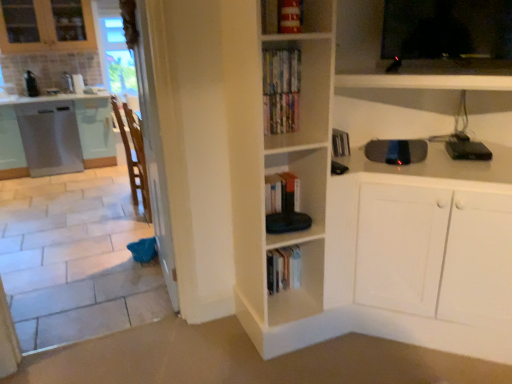
Locate an element on the screen. This screenshot has height=384, width=512. black glossy tv at upper right is located at coordinates (403, 61).

I want to click on white tile at left, so click(75, 258).

Find the location of a particular element. This screenshot has height=384, width=512. black plastic skateboard at upper right, which ranks as the first appliance in bottom-to-top order is located at coordinates (396, 151).

Describe the element at coordinates (467, 149) in the screenshot. The height and width of the screenshot is (384, 512). I see `black plastic device at upper right, which is the second appliance from bottom to top` at that location.

The image size is (512, 384). Describe the element at coordinates (50, 138) in the screenshot. I see `satin white dishwasher at left, which appears as the 2th cabinetry when viewed from the right` at that location.

You are a GUI agent. You are given a task and a screenshot of the screen. Output one action in this format:
    pyautogui.click(x=<x>, y=<y>)
    Task: Click on the black glossy tv at upper right
    This screenshot has width=512, height=384.
    Given the screenshot: What is the action you would take?
    pyautogui.click(x=403, y=61)

Is brown wooden chair at left further to the viewer compared to white tile at left?

Yes, the depth of brown wooden chair at left is greater than that of white tile at left.

Between brown wooden chair at left and white tile at left, which one has larger size?

white tile at left is bigger.

Is brown wooden chair at left situated inside white tile at left or outside?

brown wooden chair at left cannot be found inside white tile at left.

Is satin white dishwasher at left, which is the 1th cabinetry from left to right, facing towards black plastic skateboard at upper right, which appears as the second appliance when viewed from the right?

No, satin white dishwasher at left, which is the 1th cabinetry from left to right, does not turn towards black plastic skateboard at upper right, which appears as the second appliance when viewed from the right.

Can you see satin white dishwasher at left, which appears as the 2th cabinetry when viewed from the right, touching black plastic skateboard at upper right, the 3th appliance when ordered from top to bottom?

They are not placed beside each other.

Who is shorter, satin white dishwasher at left, which is the 1th cabinetry from left to right, or black plastic skateboard at upper right, which ranks as the first appliance in bottom-to-top order?

With less height is black plastic skateboard at upper right, which ranks as the first appliance in bottom-to-top order.

Image resolution: width=512 pixels, height=384 pixels. What are the coordinates of `shelf that is on the right side of hardcover books at upper center` in the screenshot? It's located at (403, 61).

Which point is more distant from viewer, (337,62) or (292,74)?

Positioned behind is point (337,62).

Would you consider black glossy tv at upper right to be distant from hardcover books at upper center?

They are positioned close to each other.

In the scene shown: Between black plastic device at upper right, which is the 1th appliance in right-to-left order, and white tile at left, which one appears on the right side from the viewer's perspective?

black plastic device at upper right, which is the 1th appliance in right-to-left order, is more to the right.

Between black plastic device at upper right, arranged as the 2th appliance when viewed from the front, and white tile at left, which one has smaller width?

black plastic device at upper right, arranged as the 2th appliance when viewed from the front, is thinner.

Is black plastic device at upper right, the second appliance viewed from the back, closer to the viewer compared to white tile at left?

No, it is not.

From the image's perspective, which is below, black plastic device at upper right, arranged as the 2th appliance when viewed from the front, or white tile at left?

white tile at left.

Based on the photo, is black plastic device at upper right, arranged as the 2th appliance when viewed from the front, facing towards black glossy tv at upper right?

No, black plastic device at upper right, arranged as the 2th appliance when viewed from the front, is not turned towards black glossy tv at upper right.

Which object is thinner, black plastic device at upper right, arranged as the second appliance when viewed from the top, or black glossy tv at upper right?

Thinner between the two is black glossy tv at upper right.

Where is `appliance that is the 2nd object located behind the black glossy tv at upper right`? This screenshot has width=512, height=384. appliance that is the 2nd object located behind the black glossy tv at upper right is located at coordinates (467, 149).

This screenshot has width=512, height=384. Identify the location of screen door that is in front of the black plastic skateboard at upper right, marked as the 2th appliance in a left-to-right arrangement. (151, 140).

Considering the positions of objects black plastic skateboard at upper right, which appears as the second appliance when viewed from the right, and transparent plastic screen door at left in the image provided, who is more to the left, black plastic skateboard at upper right, which appears as the second appliance when viewed from the right, or transparent plastic screen door at left?

Positioned to the left is transparent plastic screen door at left.

From the image's perspective, which one is positioned higher, black plastic skateboard at upper right, marked as the 2th appliance in a left-to-right arrangement, or transparent plastic screen door at left?

transparent plastic screen door at left is shown above in the image.

How distant is black plastic skateboard at upper right, marked as the 2th appliance in a left-to-right arrangement, from transparent plastic screen door at left?

black plastic skateboard at upper right, marked as the 2th appliance in a left-to-right arrangement, and transparent plastic screen door at left are 1.24 meters apart from each other.

Is brushed metal toaster at left, the third appliance when ordered from bottom to top, oriented towards satin white dishwasher at left, which is the 1th cabinetry from left to right?

No, brushed metal toaster at left, the third appliance when ordered from bottom to top, is not turned towards satin white dishwasher at left, which is the 1th cabinetry from left to right.

Is point (28, 93) farther from camera compared to point (26, 155)?

That is True.

Which of these two, brushed metal toaster at left, which is the third appliance from front to back, or satin white dishwasher at left, which is the 1th cabinetry from left to right, is smaller?

With smaller size is brushed metal toaster at left, which is the third appliance from front to back.

Is brushed metal toaster at left, arranged as the first appliance when viewed from the back, far from satin white dishwasher at left, which is the 1th cabinetry from left to right?

They are positioned close to each other.

Identify the location of tile on the left of brown wooden chair at left. (75, 258).

What are the coordinates of `appliance that is the 2nd object located below the satin white dishwasher at left, which appears as the 2th cabinetry when viewed from the right (from the image's perspective)` in the screenshot? It's located at (396, 151).

Based on the photo, looking at the image, which one is located further to satin white dishwasher at left, which appears as the 2th cabinetry when viewed from the right, white glossy cabinet at left, the 1th cabinetry in the right-to-left sequence, or black plastic skateboard at upper right, marked as the 2th appliance in a left-to-right arrangement?

black plastic skateboard at upper right, marked as the 2th appliance in a left-to-right arrangement, is positioned further to the anchor satin white dishwasher at left, which appears as the 2th cabinetry when viewed from the right.

Considering their positions, is black glossy tv at upper right positioned further to white glossy cabinet at left, placed as the 2th cabinetry when sorted from left to right, than hardcover books at upper center?

black glossy tv at upper right.

Estimate the real-world distances between objects in this image. Which object is further from black plastic skateboard at upper right, which appears as the second appliance when viewed from the right, transparent plastic screen door at left or brown wooden chair at left?

brown wooden chair at left is positioned further to the anchor black plastic skateboard at upper right, which appears as the second appliance when viewed from the right.

Estimate the real-world distances between objects in this image. Which object is further from brown wooden chair at left, black plastic device at upper right, which is the second appliance from bottom to top, or brushed metal toaster at left, the third appliance when ordered from bottom to top?

Based on the image, brushed metal toaster at left, the third appliance when ordered from bottom to top, appears to be further to brown wooden chair at left.

From the image, which object appears to be nearer to white tile at left, white glossy cabinet at left, placed as the 2th cabinetry when sorted from left to right, or satin white dishwasher at left, which is the 1th cabinetry from left to right?

Based on the image, satin white dishwasher at left, which is the 1th cabinetry from left to right, appears to be nearer to white tile at left.

Which object lies nearer to the anchor point white tile at left, black glossy tv at upper right or black plastic device at upper right, which is the 1th appliance in right-to-left order?

black glossy tv at upper right.

Estimate the real-world distances between objects in this image. Which object is further from black plastic device at upper right, arranged as the 2th appliance when viewed from the front, hardcover books at upper center or white tile at left?

white tile at left.

From the image, which object appears to be farther from brown wooden chair at left, transparent plastic screen door at left or white tile at left?

The object further to brown wooden chair at left is white tile at left.

Identify the location of appliance between transparent plastic screen door at left and black plastic device at upper right, which is the 1th appliance in right-to-left order, in the horizontal direction. (396, 151).

Where is `appliance between white tile at left and black plastic device at upper right, the second appliance viewed from the back, in the horizontal direction`? appliance between white tile at left and black plastic device at upper right, the second appliance viewed from the back, in the horizontal direction is located at coordinates (396, 151).

The height and width of the screenshot is (384, 512). What are the coordinates of `screen door between white tile at left and black plastic device at upper right, which is the second appliance from bottom to top` in the screenshot? It's located at (151, 140).

This screenshot has width=512, height=384. I want to click on chair between brushed metal toaster at left, arranged as the 1th appliance when viewed from the top, and black plastic skateboard at upper right, which ranks as the first appliance in bottom-to-top order, from left to right, so click(x=139, y=159).